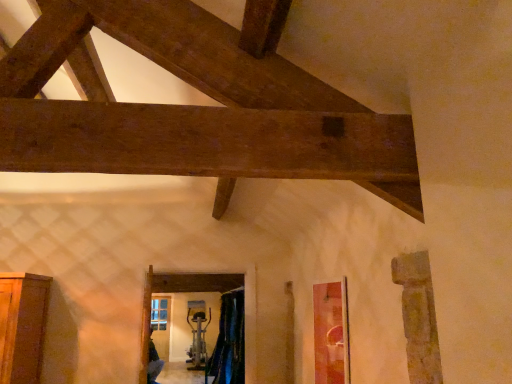
Where is `green fabric curtain at lower center`? green fabric curtain at lower center is located at coordinates (229, 342).

What do you see at coordinates (229, 342) in the screenshot?
I see `green fabric curtain at lower center` at bounding box center [229, 342].

Identify the location of green fabric curtain at lower center. Image resolution: width=512 pixels, height=384 pixels. (229, 342).